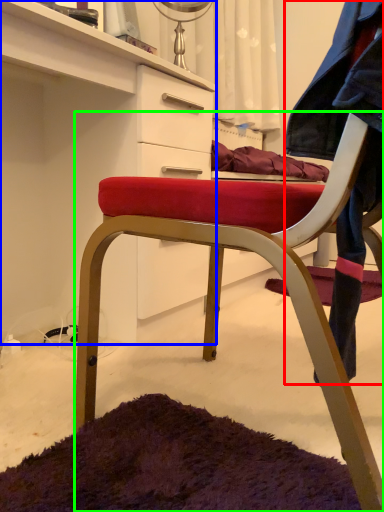
Question: Which object is positioned farthest from denim jacket (highlighted by a red box)? Select from cabinetry (highlighted by a blue box) and chair (highlighted by a green box).

Choices:
 (A) cabinetry
 (B) chair

Answer: (A)